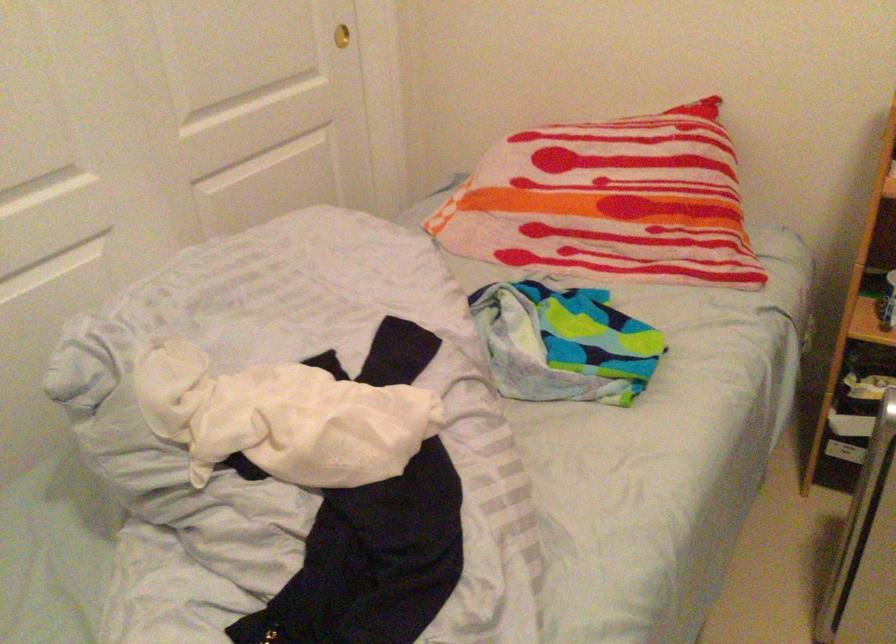
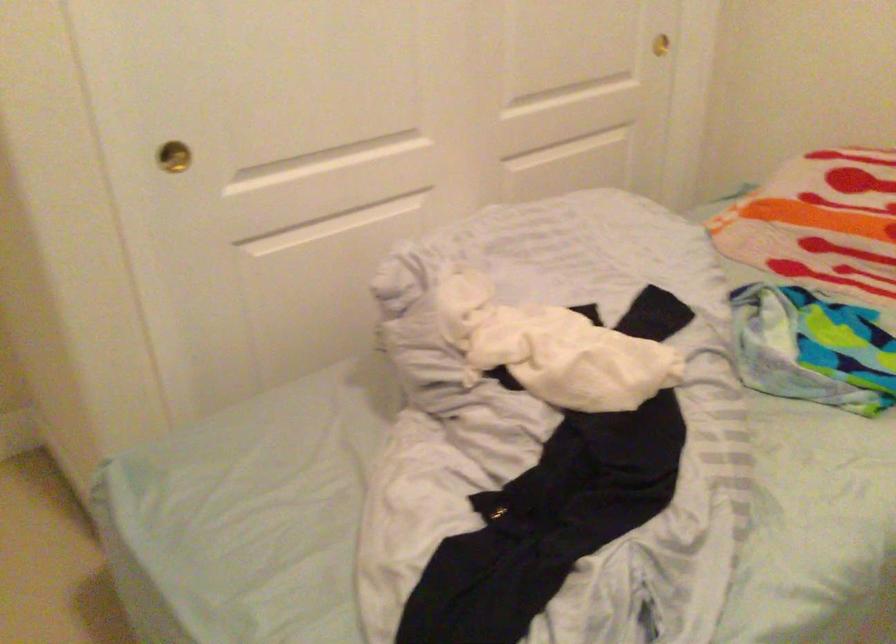
Question: The first image is from the beginning of the video and the second image is from the end. How did the camera likely rotate when shooting the video?

Choices:
 (A) Left
 (B) Right
 (C) Up
 (D) Down

Answer: (A)